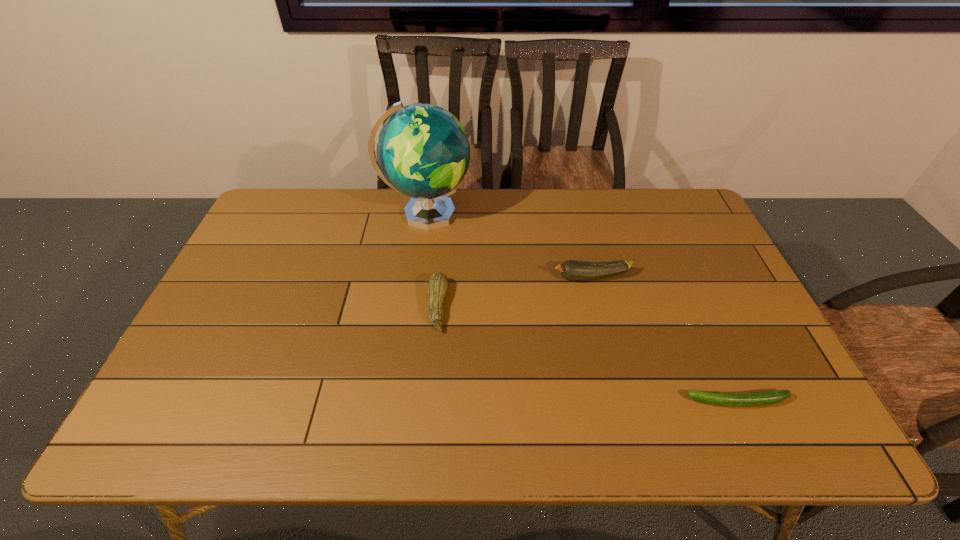
This screenshot has height=540, width=960. What are the coordinates of `vacant area that lies between the second object from right to left and the leftmost zucchini` in the screenshot? It's located at (515, 292).

Locate an element on the screen. Image resolution: width=960 pixels, height=540 pixels. free space between the second zucchini from right to left and the rightmost zucchini is located at coordinates (664, 340).

Where is `the third closest object to the second object from right to left`? The height and width of the screenshot is (540, 960). the third closest object to the second object from right to left is located at coordinates (752, 399).

Where is `the closest object relative to the shortest object`? Image resolution: width=960 pixels, height=540 pixels. the closest object relative to the shortest object is located at coordinates (574, 270).

You are a GUI agent. You are given a task and a screenshot of the screen. Output one action in this format:
    pyautogui.click(x=<x>, y=<y>)
    Task: Click on the zucchini that stands as the closest to the leftmost zucchini
    
    Given the screenshot: What is the action you would take?
    pyautogui.click(x=574, y=270)

Locate an element on the screen. the second closest zucchini to the shortest object is located at coordinates (437, 285).